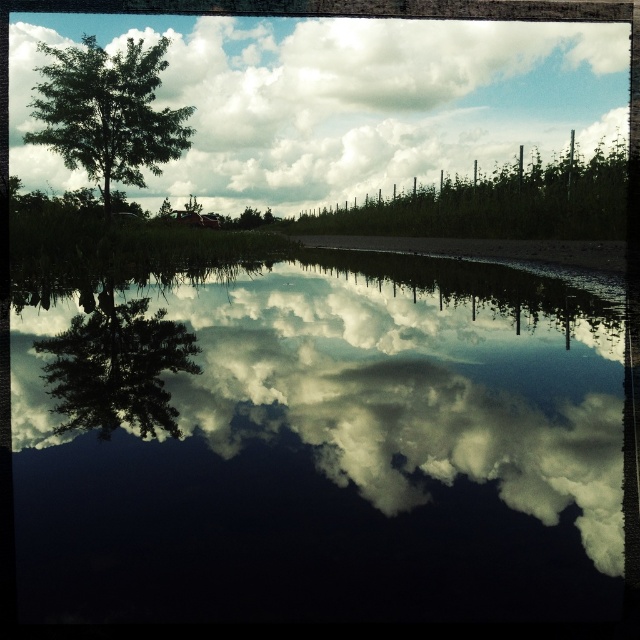
You are standing at the point with coordinates point (145, 417) and want to walk to the point with coordinates point (374, 228). Which direction should you move to reach your destination?

To reach point (374, 228) from point (145, 417), you should move towards the upper left direction since point (374, 228) is behind point (145, 417).

You are a photographer trying to capture the reflection of the cloudy sky at upper center in the water. Where should you position yourself to ensure the reflection is clearly visible in your shot?

The cloudy sky at upper center is located at point (340, 100), so you should position yourself directly in front of that point to capture its reflection in the water.

You are planning to place a small floating decoration on the water. Given the size of the glossy reflective water at center and the green leafy tree at left, which area would provide more space for the decoration?

The glossy reflective water at center has a larger size compared to the green leafy tree at left, so it would provide more space for the decoration.